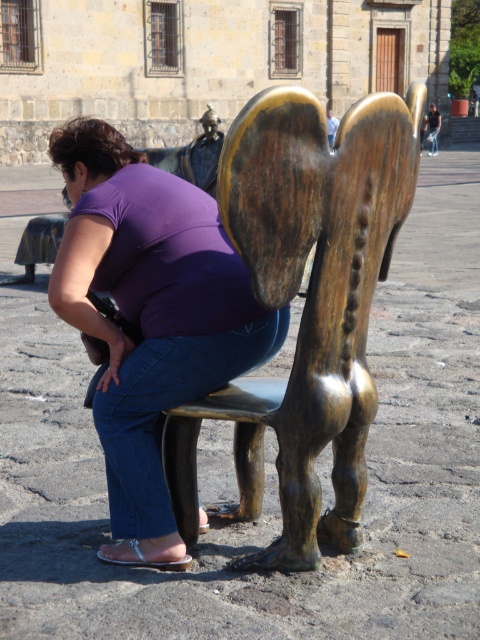
Question: In this image, where is bronze statue at center located relative to purple fabric at center?

Choices:
 (A) below
 (B) above

Answer: (B)

Question: Does bronze statue at center have a larger size compared to purple fabric at center?

Choices:
 (A) no
 (B) yes

Answer: (A)

Question: Among these points, which one is farthest from the camera?

Choices:
 (A) [151, 515]
 (B) [346, 520]

Answer: (B)

Question: Is bronze statue at center in front of purple fabric at center?

Choices:
 (A) yes
 (B) no

Answer: (A)

Question: Which point appears closest to the camera in this image?

Choices:
 (A) (127, 310)
 (B) (178, 518)

Answer: (A)